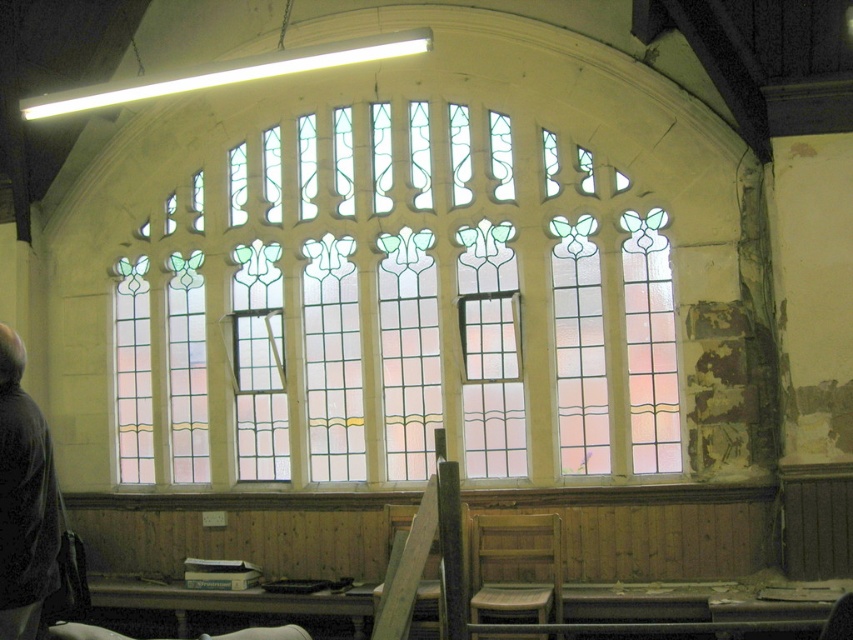
You are a window installer who needs to replace the clear stained glass at center and the pink stained glass window at center. The tools you have are 1.5 meters long. Can you safely reach both pieces of glass with your tools without moving the ladder?

The clear stained glass at center is 1.43 meters away from the pink stained glass window at center. Since your tools are 1.5 meters long, you can safely reach both pieces of glass without moving the ladder as the distance between them is within the tool length.